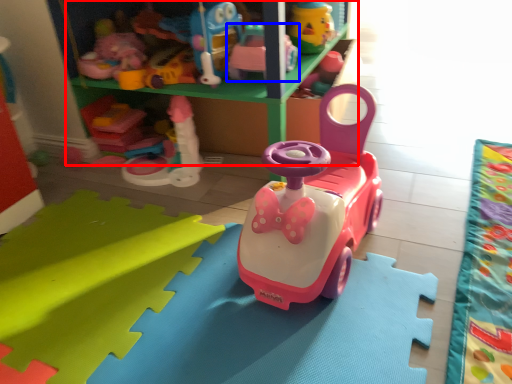
Question: Which object is further to the camera taking this photo, shelf (highlighted by a red box) or toy (highlighted by a blue box)?

Choices:
 (A) shelf
 (B) toy

Answer: (B)